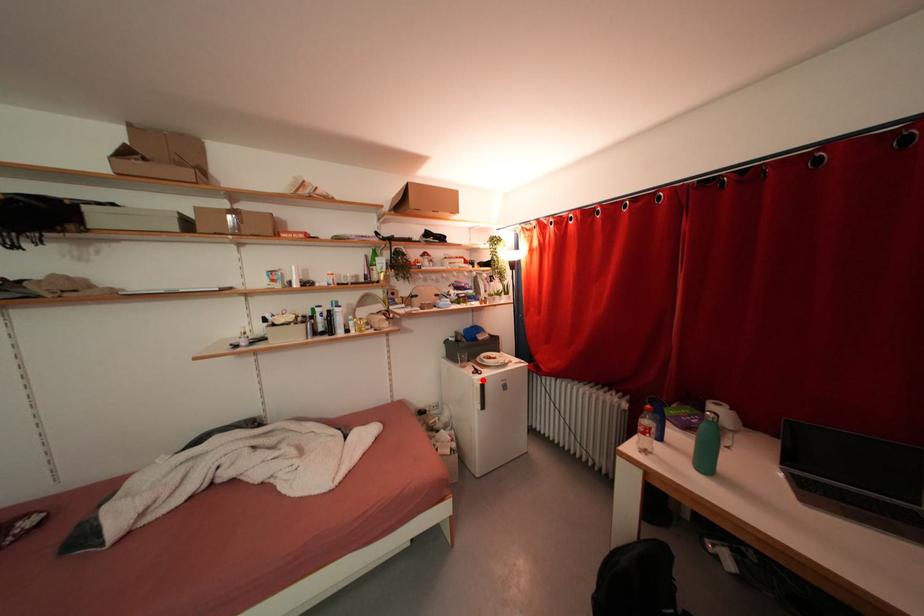
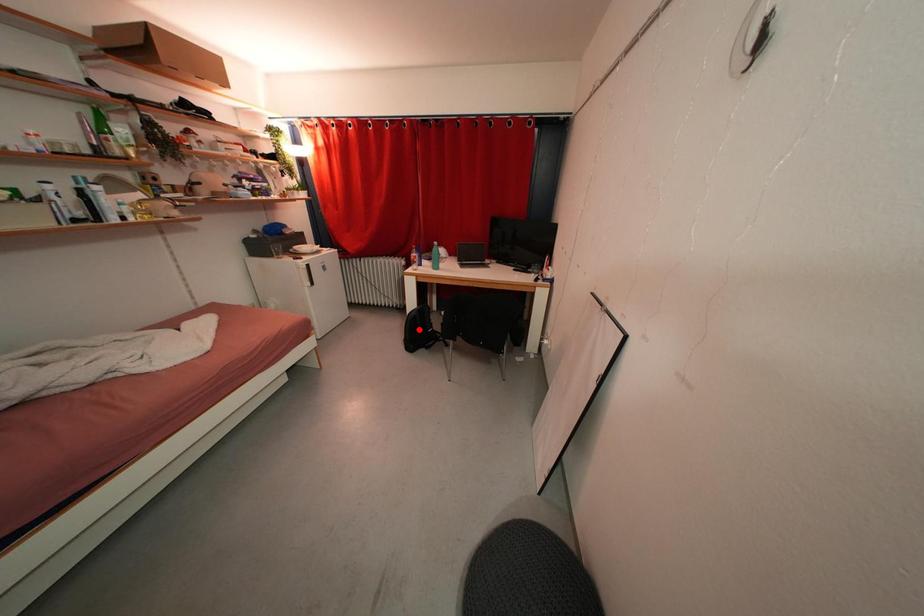
I am providing you with two images of the same scene from different viewpoints. A red point is marked on the first image and another point is marked on the second image. Is the marked point in image1 the same physical position as the marked point in image2?

No